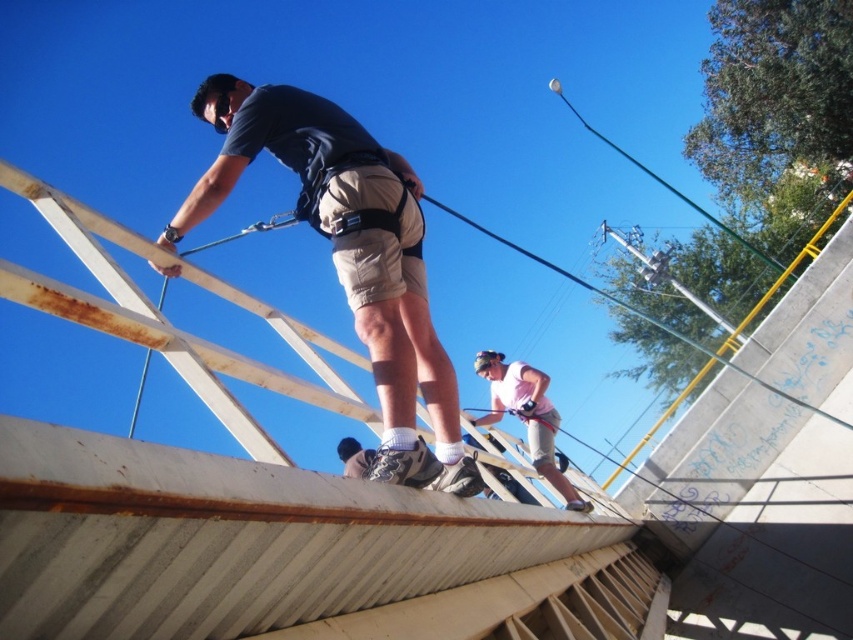
Question: Which of the following is the closest to the observer?

Choices:
 (A) click(x=428, y=381)
 (B) click(x=506, y=408)

Answer: (A)

Question: Does matte khaki shorts at center appear over pink fabric skateboarder at lower center?

Choices:
 (A) yes
 (B) no

Answer: (A)

Question: Which point is farther to the camera?

Choices:
 (A) (543, 388)
 (B) (343, 179)

Answer: (A)

Question: Is the position of matte khaki shorts at center more distant than that of pink fabric skateboarder at lower center?

Choices:
 (A) no
 (B) yes

Answer: (A)

Question: Can you confirm if matte khaki shorts at center is positioned above pink fabric skateboarder at lower center?

Choices:
 (A) yes
 (B) no

Answer: (A)

Question: Among these objects, which one is farthest from the camera?

Choices:
 (A) pink fabric skateboarder at lower center
 (B) matte khaki shorts at center

Answer: (A)